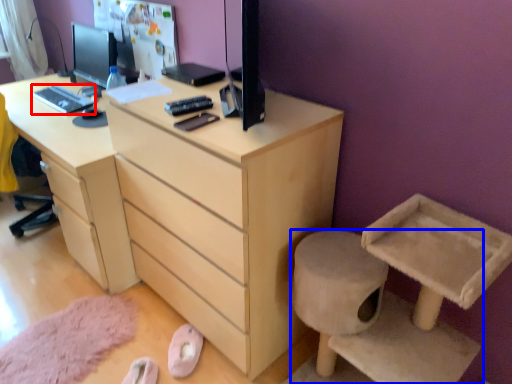
Question: Which point is closer to the camera, desktop (highlighted by a red box) or furniture (highlighted by a blue box)?

Choices:
 (A) desktop
 (B) furniture

Answer: (B)